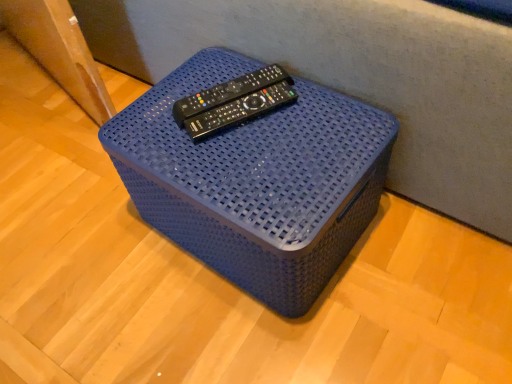
Where is `vacant point above blue woven basket at center (from a real-world perspective)`? The image size is (512, 384). vacant point above blue woven basket at center (from a real-world perspective) is located at coordinates (238, 127).